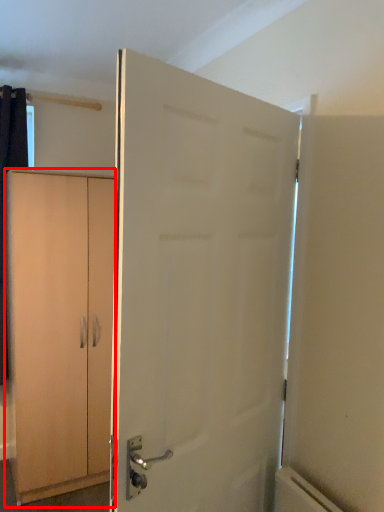
Question: From the image's perspective, what is the correct spatial relationship of cabinetry (annotated by the red box) in relation to door?

Choices:
 (A) above
 (B) below

Answer: (B)